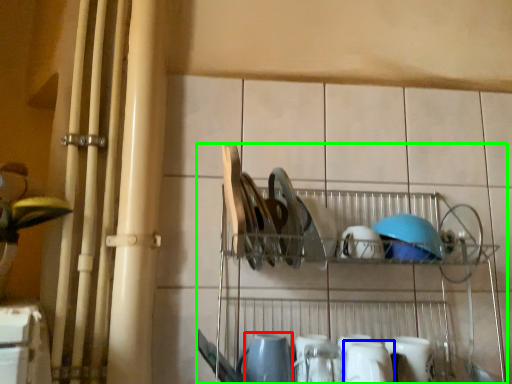
Question: Estimate the real-world distances between objects in this image. Which object is closer to tableware (highlighted by a red box), tableware (highlighted by a blue box) or shelf (highlighted by a green box)?

Choices:
 (A) tableware
 (B) shelf

Answer: (A)